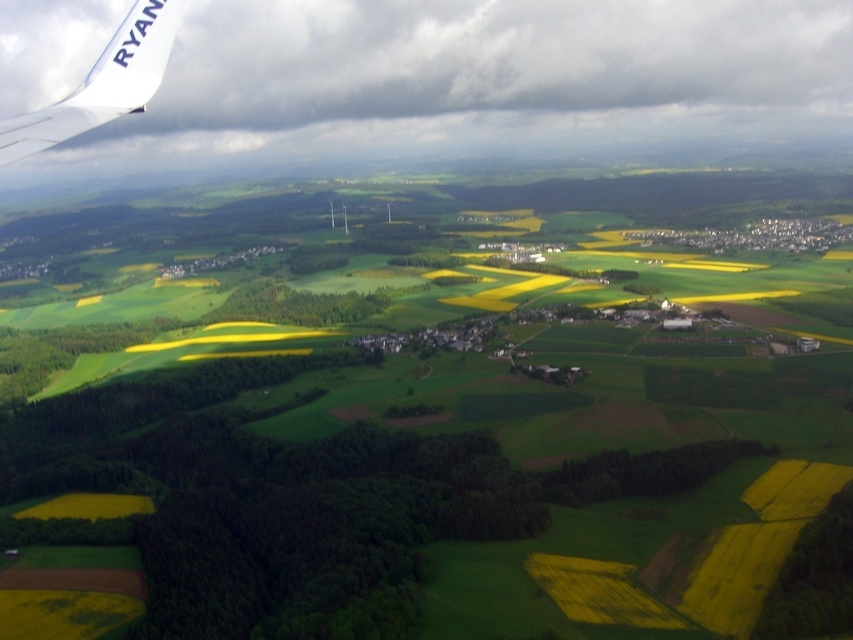
Between point (781, 77) and point (54, 132), which one is positioned behind?

Point (781, 77)

Can you confirm if white fluffy cloud at upper left is bigger than white matte airplane wing at upper left?

Indeed, white fluffy cloud at upper left has a larger size compared to white matte airplane wing at upper left.

Find the location of a particular element. The image size is (853, 640). white fluffy cloud at upper left is located at coordinates (485, 80).

Image resolution: width=853 pixels, height=640 pixels. Find the location of `white fluffy cloud at upper left`. white fluffy cloud at upper left is located at coordinates (485, 80).